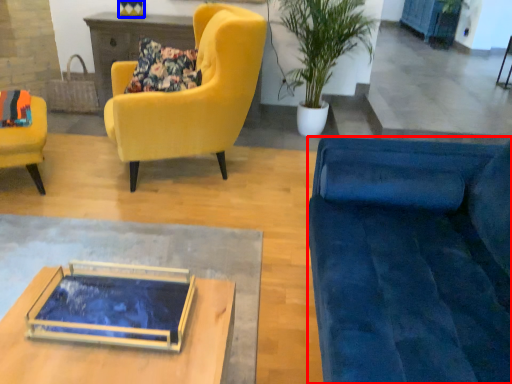
Question: Which object is closer to the camera taking this photo, studio couch (highlighted by a red box) or vase (highlighted by a blue box)?

Choices:
 (A) studio couch
 (B) vase

Answer: (A)